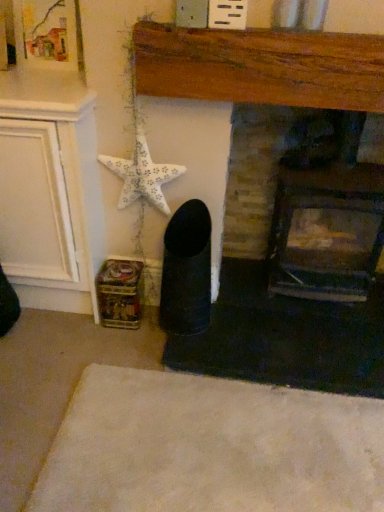
Locate an element on the screen. vacant space situated above wooden fireplace at center, the first fireplace positioned from the left (from a real-world perspective) is located at coordinates (278, 9).